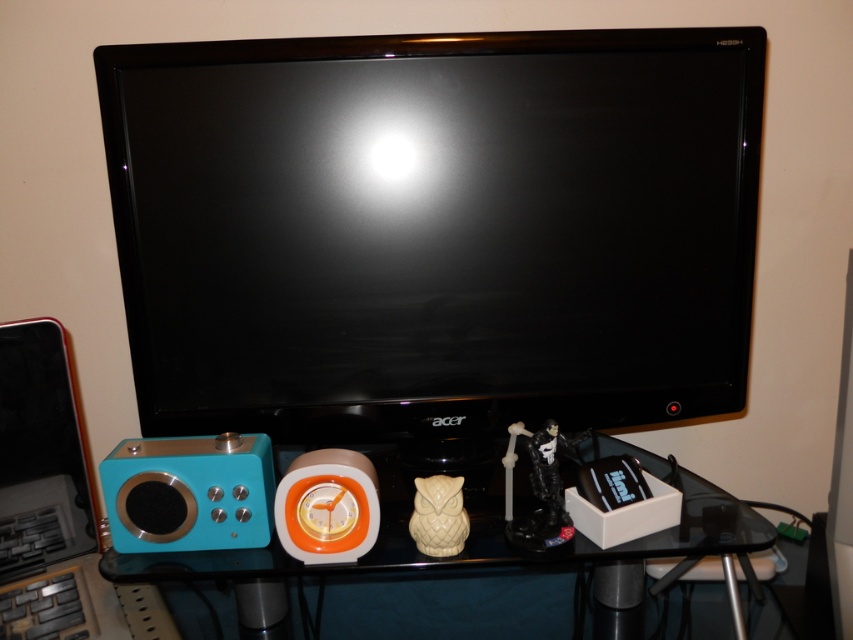
How distant is black glossy monitor at center from teal plastic speaker at lower left?

black glossy monitor at center and teal plastic speaker at lower left are 11.52 inches apart from each other.

Between point (387, 396) and point (236, 522), which one is positioned in front?

Point (236, 522) is more forward.

At what (x,y) coordinates should I click in order to perform the action: click on black glossy monitor at center. Please return your answer as a coordinate pair (x, y). The width and height of the screenshot is (853, 640). Looking at the image, I should click on (434, 228).

Based on the photo, between black glossy monitor at center and translucent glass shelf at center, which one appears on the left side from the viewer's perspective?

translucent glass shelf at center

Where is `black glossy monitor at center`? black glossy monitor at center is located at coordinates (434, 228).

Can you confirm if translucent glass shelf at center is shorter than teal plastic speaker at lower left?

Yes, translucent glass shelf at center is shorter than teal plastic speaker at lower left.

Is translucent glass shelf at center closer to the viewer compared to teal plastic speaker at lower left?

Yes, translucent glass shelf at center is in front of teal plastic speaker at lower left.

The image size is (853, 640). Describe the element at coordinates (326, 564) in the screenshot. I see `translucent glass shelf at center` at that location.

The width and height of the screenshot is (853, 640). Identify the location of translucent glass shelf at center. (326, 564).